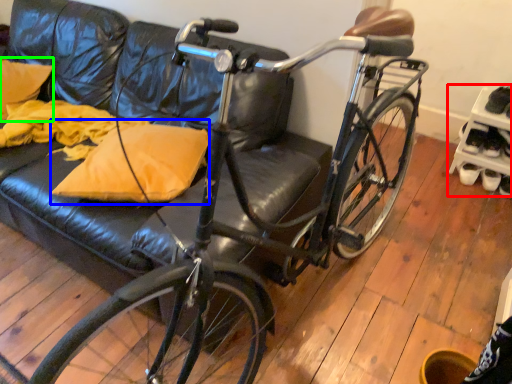
Question: Which is nearer to the shelf (highlighted by a red box)? throw pillow (highlighted by a blue box) or pillow (highlighted by a green box).

Choices:
 (A) throw pillow
 (B) pillow

Answer: (A)